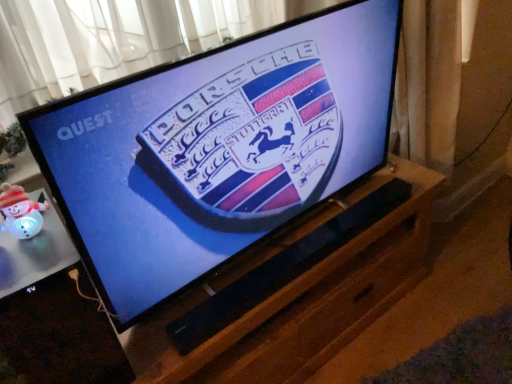
Question: From the image's perspective, is black glossy tv at center located above black matte speaker at center?

Choices:
 (A) yes
 (B) no

Answer: (A)

Question: Considering the relative sizes of black glossy tv at center and black matte speaker at center in the image provided, is black glossy tv at center bigger than black matte speaker at center?

Choices:
 (A) no
 (B) yes

Answer: (B)

Question: Is black glossy tv at center positioned with its back to black matte speaker at center?

Choices:
 (A) no
 (B) yes

Answer: (A)

Question: Does black glossy tv at center lie in front of black matte speaker at center?

Choices:
 (A) no
 (B) yes

Answer: (B)

Question: Considering the relative positions of black glossy tv at center and black matte speaker at center in the image provided, is black glossy tv at center to the left of black matte speaker at center from the viewer's perspective?

Choices:
 (A) yes
 (B) no

Answer: (A)

Question: Would you say black glossy tv at center is to the left or to the right of white glossy snowman at lower left in the picture?

Choices:
 (A) left
 (B) right

Answer: (B)

Question: Considering their positions, is black glossy tv at center located in front of or behind white glossy snowman at lower left?

Choices:
 (A) front
 (B) behind

Answer: (B)

Question: Is black glossy tv at center bigger or smaller than white glossy snowman at lower left?

Choices:
 (A) small
 (B) big

Answer: (B)

Question: In terms of height, does black glossy tv at center look taller or shorter compared to white glossy snowman at lower left?

Choices:
 (A) short
 (B) tall

Answer: (B)

Question: Based on their sizes in the image, would you say white glossy snowman at lower left is bigger or smaller than black matte speaker at center?

Choices:
 (A) big
 (B) small

Answer: (A)

Question: From the image's perspective, is white glossy snowman at lower left above or below black matte speaker at center?

Choices:
 (A) below
 (B) above

Answer: (A)

Question: Considering their positions, is white glossy snowman at lower left located in front of or behind black matte speaker at center?

Choices:
 (A) front
 (B) behind

Answer: (A)

Question: Do you think white glossy snowman at lower left is within black matte speaker at center, or outside of it?

Choices:
 (A) inside
 (B) outside

Answer: (B)

Question: Based on their positions, is white glossy snowman at lower left located to the left or right of black glossy tv at center?

Choices:
 (A) left
 (B) right

Answer: (A)

Question: In terms of width, does white glossy snowman at lower left look wider or thinner when compared to black glossy tv at center?

Choices:
 (A) thin
 (B) wide

Answer: (B)